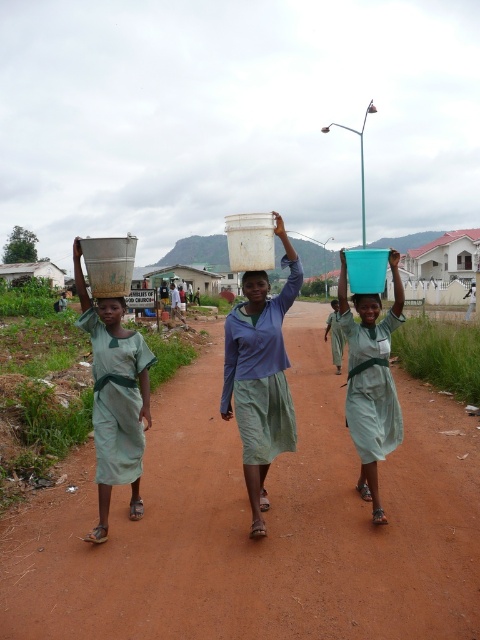
You are a photographer trying to capture a clear shot of the blue matte bucket at center and the matte plastic head at center. Which object should you focus on first to ensure both are in focus?

The blue matte bucket at center is in front of the matte plastic head at center. To ensure both are in focus, you should focus on the blue matte bucket at center first since it is closer to the camera.

You are a photographer positioned at the center of the dirt road. You want to capture a photo that includes both the blue matte bucket at center and the girl on the left with the metallic bucket. Which direction should you move to ensure both are in the frame?

The blue matte bucket at center is located at point (x=371, y=380), so you should move to the left to include both the blue matte bucket at center and the girl on the left with the metallic bucket in the frame.

From the picture: You are standing on the dirt road in the rural scene. There are two points marked on the road ahead of you at coordinates point [340,312] and point [253,289]. If you want to reach the point that is closer to you, which coordinate should you walk towards?

You should walk towards point [253,289] because it is closer to you than point [340,312].